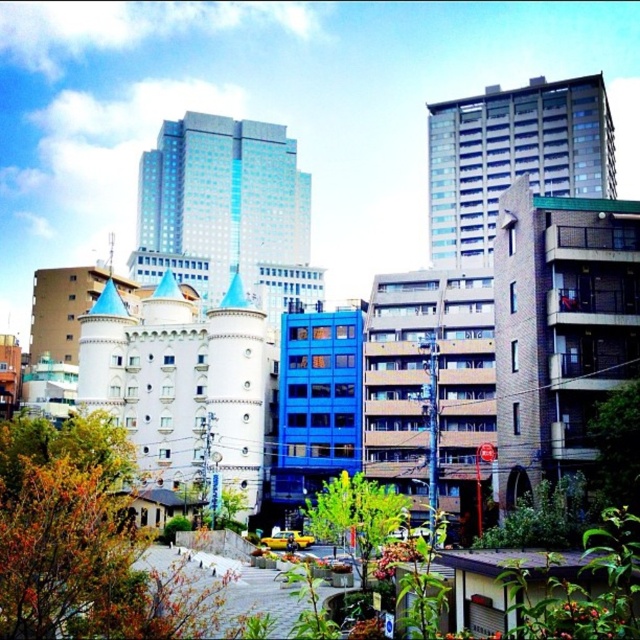
Question: Is blue glass skyscraper at center above green leafy tree at lower right?

Choices:
 (A) yes
 (B) no

Answer: (A)

Question: Which object is positioned closest to the blue glass skyscraper at center?

Choices:
 (A) green leafy tree at center
 (B) green leafy tree at lower right

Answer: (A)

Question: Which point appears farthest from the camera in this image?

Choices:
 (A) (586, 189)
 (B) (625, 465)
 (C) (388, 508)
 (D) (208, 221)

Answer: (D)

Question: Can you confirm if gray concrete building at upper center is thinner than green leafy tree at lower right?

Choices:
 (A) yes
 (B) no

Answer: (B)

Question: In this image, where is blue glass skyscraper at center located relative to green leafy tree at lower right?

Choices:
 (A) left
 (B) right

Answer: (A)

Question: Among these points, which one is farthest from the camera?

Choices:
 (A) (620, 448)
 (B) (508, 129)
 (C) (276, 312)

Answer: (C)